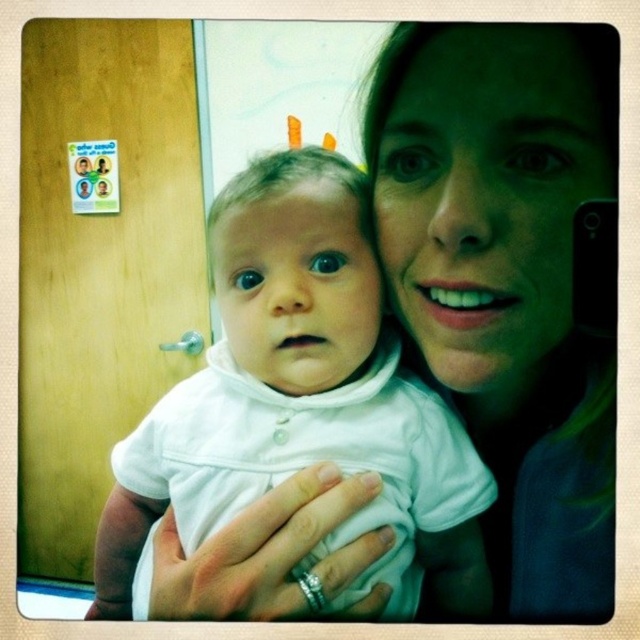
Question: Can you confirm if matte white shirt at center is positioned to the left of white matte baby at center?

Choices:
 (A) yes
 (B) no

Answer: (B)

Question: Which of the following is the closest to the observer?

Choices:
 (A) (323, 324)
 (B) (593, 340)

Answer: (A)

Question: Is matte white shirt at center below white matte baby at center?

Choices:
 (A) yes
 (B) no

Answer: (B)

Question: Which point is closer to the camera?

Choices:
 (A) white matte baby at center
 (B) matte white shirt at center

Answer: (B)

Question: Among these points, which one is farthest from the camera?

Choices:
 (A) (452, 256)
 (B) (336, 365)

Answer: (B)

Question: Is matte white shirt at center positioned at the back of white matte baby at center?

Choices:
 (A) no
 (B) yes

Answer: (A)